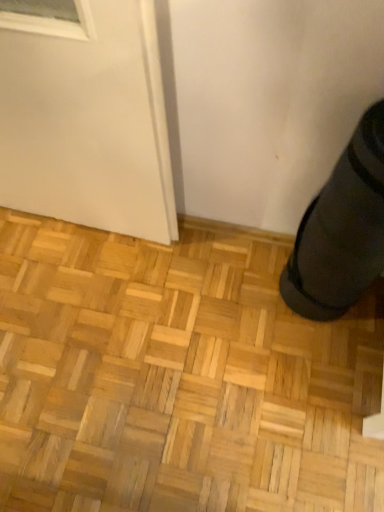
You are a GUI agent. You are given a task and a screenshot of the screen. Output one action in this format:
    pyautogui.click(x=<x>, y=<y>)
    Task: Click on the free space above natural wood parquet floor at lower right (from a real-world perspective)
    This screenshot has height=512, width=384.
    Given the screenshot: What is the action you would take?
    pyautogui.click(x=162, y=359)